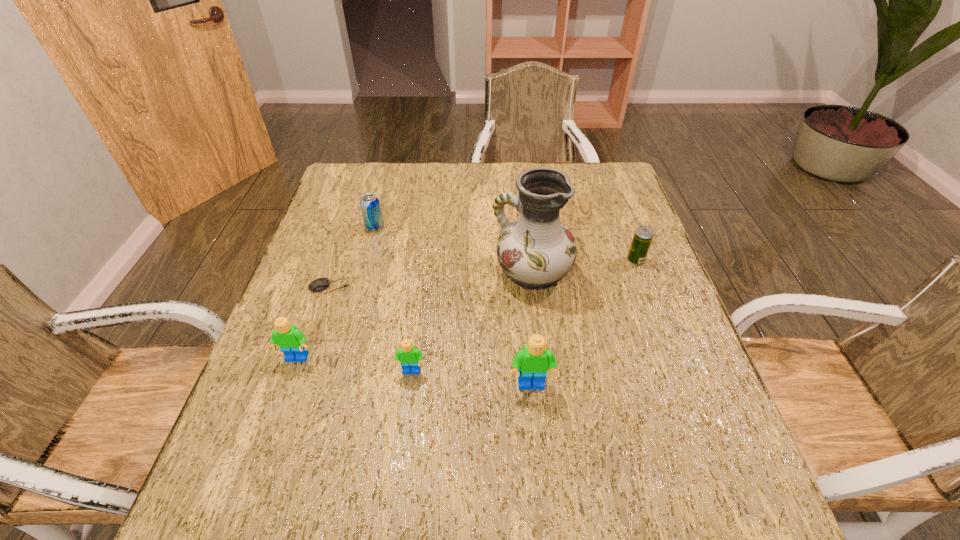
Locate an element on the screen. This screenshot has width=960, height=540. beer can that is at the left edge is located at coordinates pyautogui.click(x=370, y=207).

This screenshot has width=960, height=540. Identify the location of mouse present at the left edge. [321, 284].

The width and height of the screenshot is (960, 540). Identify the location of object that is at the right edge. (643, 235).

Find the location of `free space at the far edge of the desktop`. free space at the far edge of the desktop is located at coordinates (407, 180).

Locate an element on the screen. The image size is (960, 540). free space at the near edge is located at coordinates (359, 417).

Where is `blank space at the left edge of the desktop`? The width and height of the screenshot is (960, 540). blank space at the left edge of the desktop is located at coordinates (337, 260).

I want to click on free space at the right edge of the desktop, so pyautogui.click(x=618, y=339).

This screenshot has width=960, height=540. I want to click on free location at the far right corner of the desktop, so click(x=612, y=165).

Locate an element on the screen. The width and height of the screenshot is (960, 540). free spot between the nearer beer can and the rightmost Lego is located at coordinates (584, 323).

What are the coordinates of `free space that is in between the shortest Lego and the mouse` in the screenshot? It's located at (371, 329).